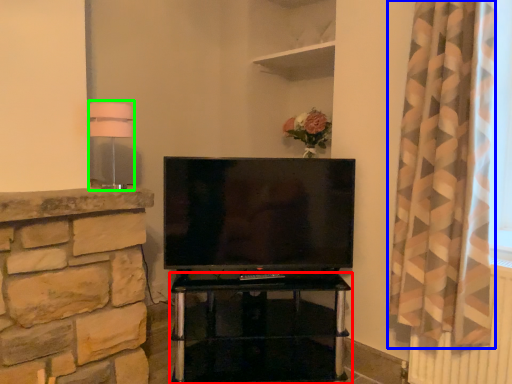
Question: Considering the real-world distances, which object is closest to furniture (highlighted by a red box)? curtain (highlighted by a blue box) or lamp (highlighted by a green box).

Choices:
 (A) curtain
 (B) lamp

Answer: (A)